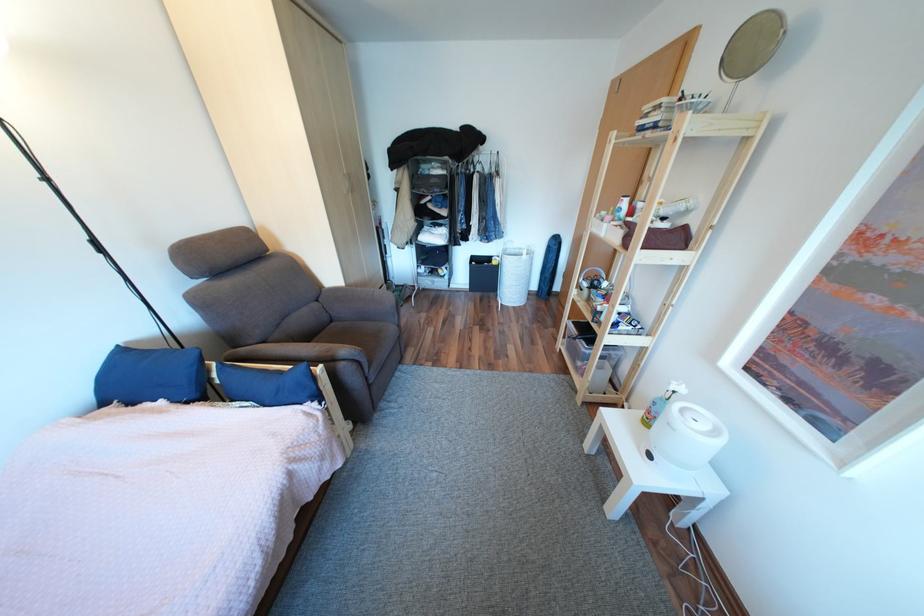
What do you see at coordinates (360, 334) in the screenshot? I see `the gray recliner sitting surface` at bounding box center [360, 334].